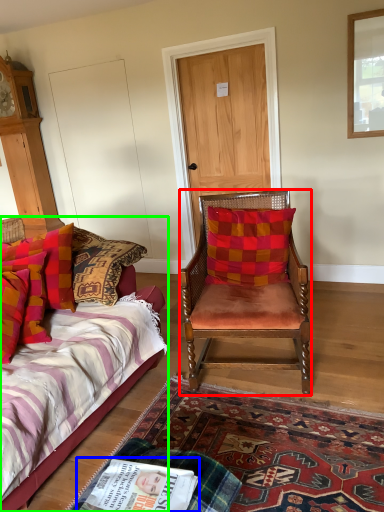
Question: Based on their relative distances, which object is farther from chair (highlighted by a red box)? Choose from magazine (highlighted by a blue box) and bed (highlighted by a green box).

Choices:
 (A) magazine
 (B) bed

Answer: (A)